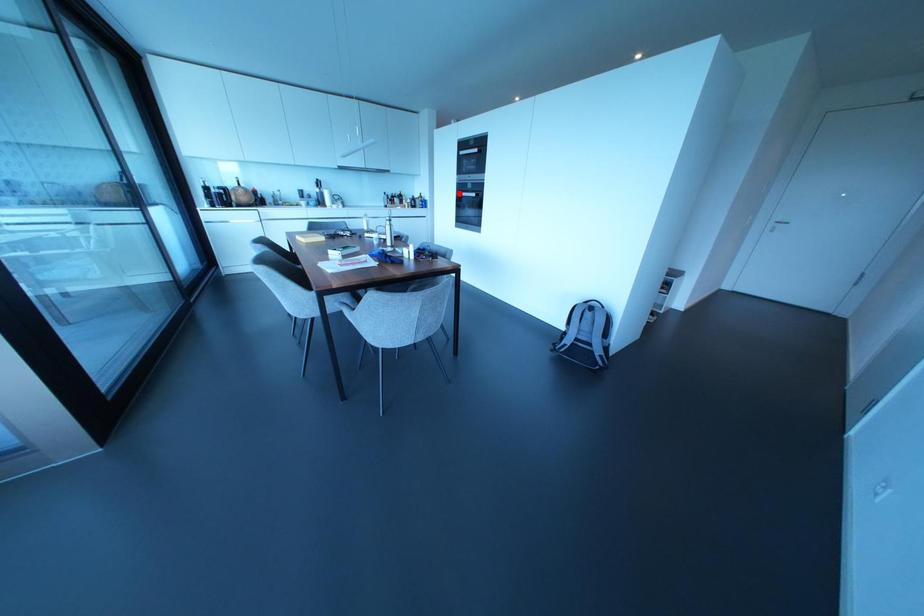
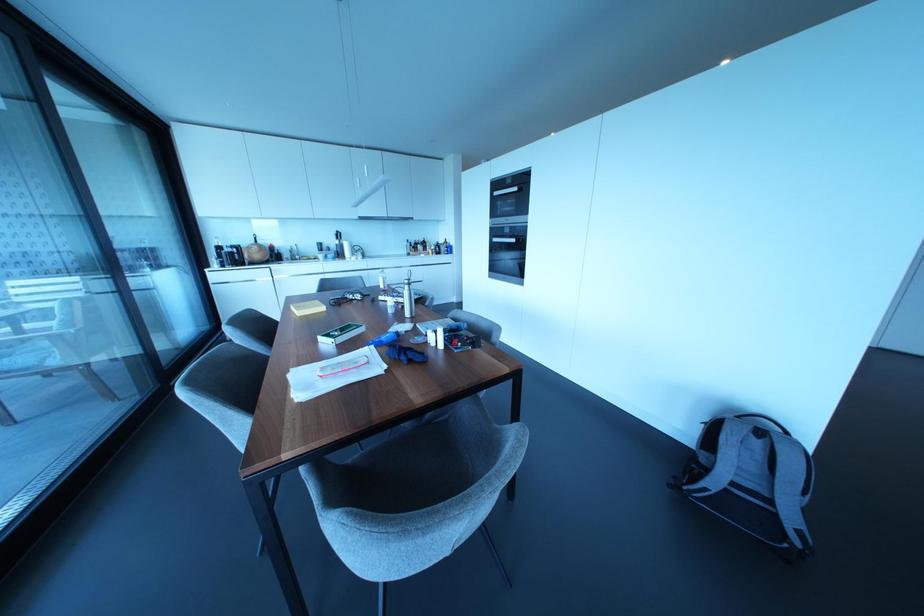
The point at the highlighted location is marked in the first image. Where is the corresponding point in the second image?

(493, 238)